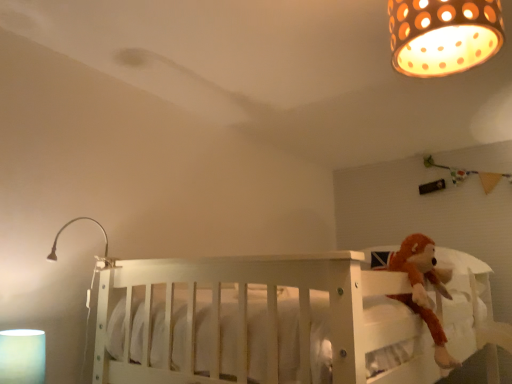
Question: Relative to matte brown lampshade at upper right, the third lamp in the bottom-to-top sequence, is brown plush monkey at right in front or behind?

Choices:
 (A) front
 (B) behind

Answer: (B)

Question: Is brown plush monkey at right inside or outside of matte brown lampshade at upper right, marked as the first lamp in a right-to-left arrangement?

Choices:
 (A) outside
 (B) inside

Answer: (A)

Question: Estimate the real-world distances between objects in this image. Which object is farther from the brown plush monkey at right?

Choices:
 (A) white matte cylinder at lower left, the 2th lamp in the front-to-back sequence
 (B) metallic silver lamp at upper left, the second lamp in the bottom-to-top sequence
 (C) white wooden crib at center
 (D) matte brown lampshade at upper right, marked as the first lamp in a right-to-left arrangement

Answer: (A)

Question: Which is nearer to the matte brown lampshade at upper right, which appears as the third lamp when viewed from the left?

Choices:
 (A) brown plush monkey at right
 (B) metallic silver lamp at upper left, arranged as the 2th lamp when viewed from the top
 (C) white wooden crib at center
 (D) white matte cylinder at lower left, acting as the first lamp starting from the bottom

Answer: (A)